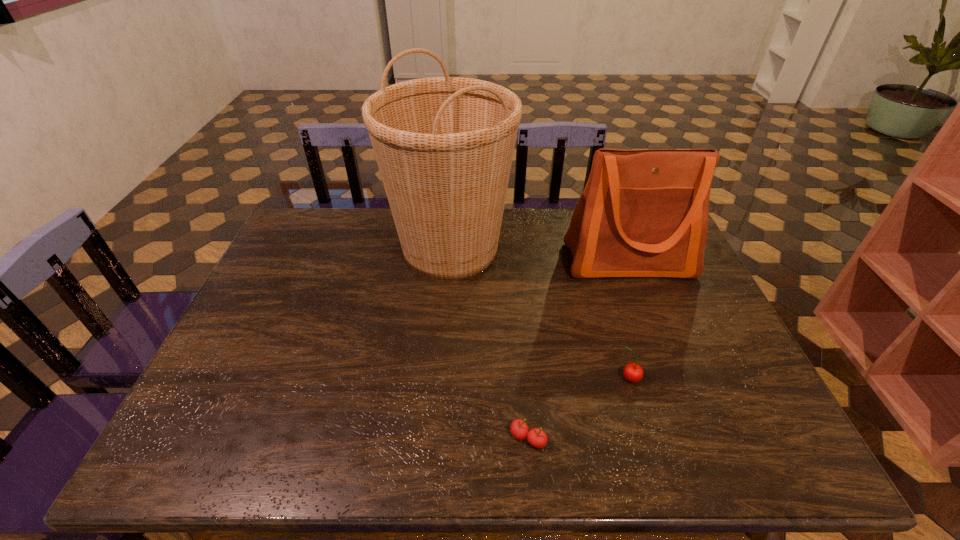
The width and height of the screenshot is (960, 540). In order to click on empty space that is in between the basket and the shopping bag in this screenshot , I will do tap(540, 255).

Locate an element on the screen. The image size is (960, 540). the second closest object relative to the shortest object is located at coordinates (444, 146).

Identify the location of object that is the closest one to the third tallest object. (536, 437).

At what (x,y) coordinates should I click in order to perform the action: click on vacant space that satisfies the following two spatial constraints: 1. on the front side of the nearer cherry; 2. on the left side of the basket. Please return your answer as a coordinate pair (x, y). The height and width of the screenshot is (540, 960). Looking at the image, I should click on (436, 438).

At what (x,y) coordinates should I click in order to perform the action: click on vacant region that satisfies the following two spatial constraints: 1. on the back side of the third farthest object; 2. on the left side of the shorter cherry. Please return your answer as a coordinate pair (x, y). This screenshot has width=960, height=540. Looking at the image, I should click on (523, 379).